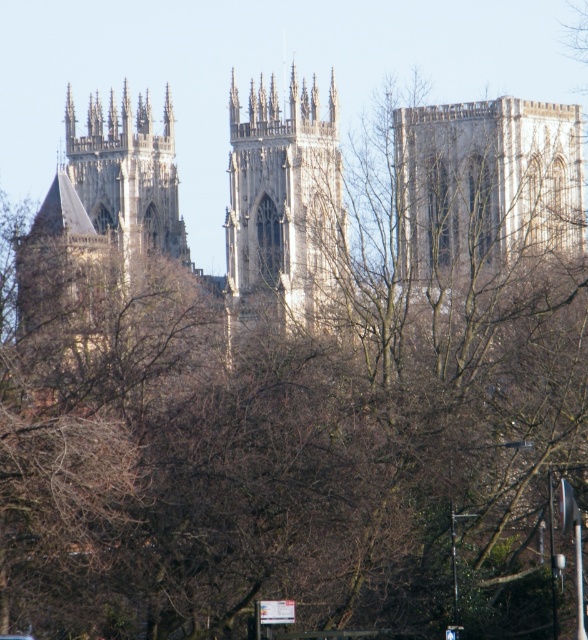
In the scene shown: Can you confirm if stone gothic tower at center is smaller than stone gothic tower at left?

No.

Is stone gothic tower at center thinner than stone gothic tower at left?

Yes.

I want to click on stone gothic tower at center, so click(x=282, y=209).

Which of these two, stone tower at upper right or stone steeple at left, stands taller?

Standing taller between the two is stone steeple at left.

Does stone tower at upper right appear under stone steeple at left?

No, stone tower at upper right is not below stone steeple at left.

Is point (417, 276) closer to viewer compared to point (69, 342)?

No, (417, 276) is further to viewer.

At what (x,y) coordinates should I click in order to perform the action: click on stone tower at upper right. Please return your answer as a coordinate pair (x, y). Looking at the image, I should click on (486, 188).

Between stone gothic tower at left and stone steeple at left, which one appears on the right side from the viewer's perspective?

stone gothic tower at left is more to the right.

Measure the distance between stone gothic tower at left and camera.

stone gothic tower at left is 510.98 feet away from camera.

Is point (159, 205) less distant than point (61, 328)?

That is False.

I want to click on stone gothic tower at left, so click(125, 179).